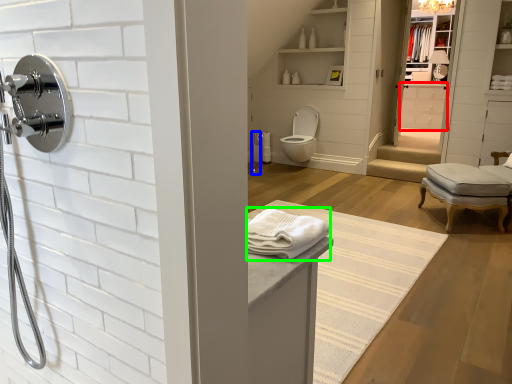
Question: Considering the real-world distances, which object is farthest from cabinetry (highlighted by a red box)? shower (highlighted by a blue box) or bath towel (highlighted by a green box)?

Choices:
 (A) shower
 (B) bath towel

Answer: (B)